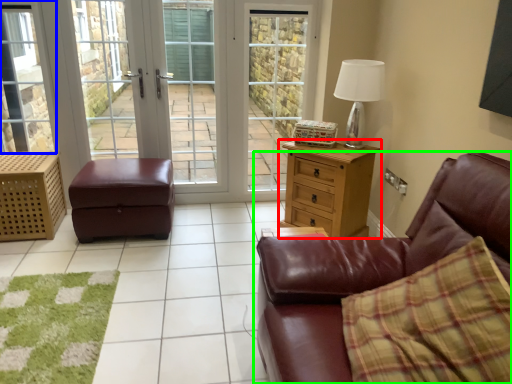
Question: Considering the real-world distances, which object is closest to chest of drawers (highlighted by a red box)? window (highlighted by a blue box) or studio couch (highlighted by a green box).

Choices:
 (A) window
 (B) studio couch

Answer: (B)